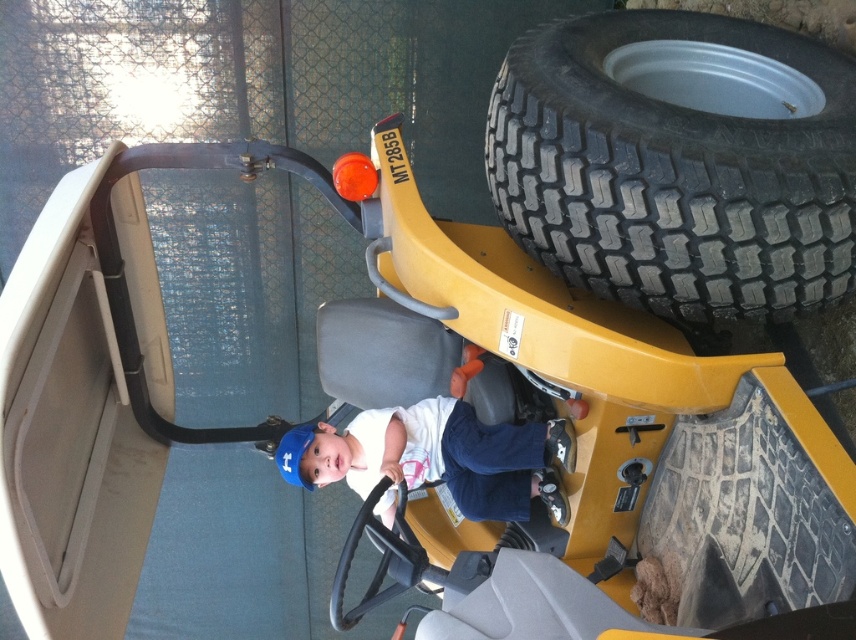
Question: Observing the image, what is the correct spatial positioning of black rubber tire at right in reference to white fabric shirt at center?

Choices:
 (A) right
 (B) left

Answer: (A)

Question: Is black rubber tire at right in front of white fabric shirt at center?

Choices:
 (A) yes
 (B) no

Answer: (A)

Question: Is the position of black rubber tire at right more distant than that of white fabric shirt at center?

Choices:
 (A) no
 (B) yes

Answer: (A)

Question: Which point is farther to the camera?

Choices:
 (A) (709, 168)
 (B) (372, 442)

Answer: (B)